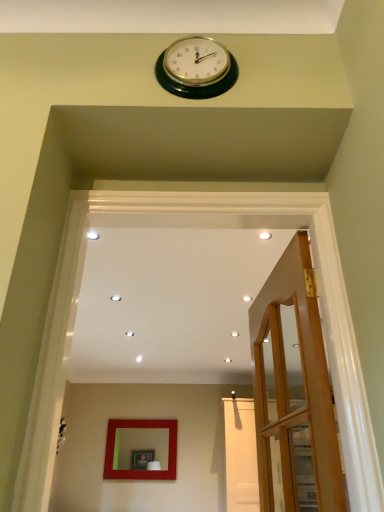
Question: Looking at their shapes, would you say wooden door at right is wider or thinner than matte red mirror at center?

Choices:
 (A) wide
 (B) thin

Answer: (A)

Question: In the image, is wooden door at right on the left side or the right side of matte red mirror at center?

Choices:
 (A) left
 (B) right

Answer: (B)

Question: Relative to matte red mirror at center, is wooden door at right in front or behind?

Choices:
 (A) front
 (B) behind

Answer: (A)

Question: Is point (114, 441) closer or farther from the camera than point (319, 458)?

Choices:
 (A) closer
 (B) farther

Answer: (B)

Question: Considering the positions of matte red mirror at center and wooden door at right in the image, is matte red mirror at center wider or thinner than wooden door at right?

Choices:
 (A) thin
 (B) wide

Answer: (A)

Question: Considering their positions, is matte red mirror at center located in front of or behind wooden door at right?

Choices:
 (A) behind
 (B) front

Answer: (A)

Question: Looking at the image, does matte red mirror at center seem bigger or smaller compared to wooden door at right?

Choices:
 (A) big
 (B) small

Answer: (B)